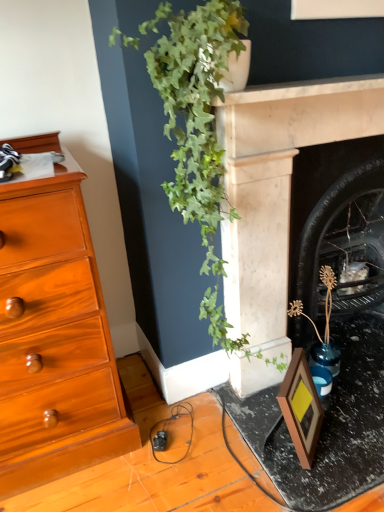
Image resolution: width=384 pixels, height=512 pixels. I want to click on vacant space to the right of wooden picture frame at lower right, so click(x=341, y=413).